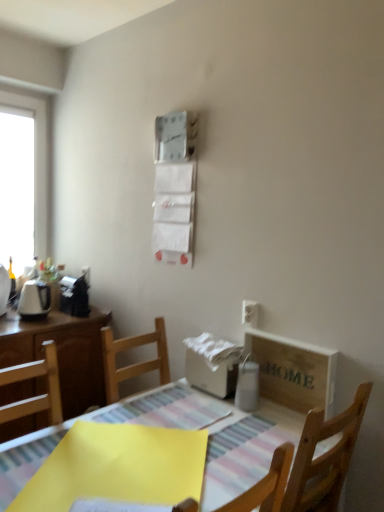
The width and height of the screenshot is (384, 512). What are the coordinates of `free space above wooden crate at lower right (from a real-world perspective)` in the screenshot? It's located at (290, 337).